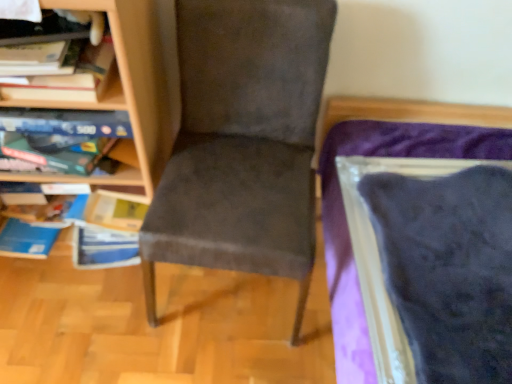
Question: Is wooden bookcase at left outside of suede-like gray chair at center?

Choices:
 (A) no
 (B) yes

Answer: (B)

Question: Is suede-like gray chair at center at the back of wooden bookcase at left?

Choices:
 (A) yes
 (B) no

Answer: (B)

Question: Considering the relative sizes of wooden bookcase at left and suede-like gray chair at center in the image provided, is wooden bookcase at left shorter than suede-like gray chair at center?

Choices:
 (A) yes
 (B) no

Answer: (B)

Question: Does wooden bookcase at left have a smaller size compared to suede-like gray chair at center?

Choices:
 (A) yes
 (B) no

Answer: (B)

Question: Does wooden bookcase at left lie behind suede-like gray chair at center?

Choices:
 (A) yes
 (B) no

Answer: (A)

Question: Does wooden bookcase at left appear on the left side of suede-like gray chair at center?

Choices:
 (A) yes
 (B) no

Answer: (A)

Question: Does suede-like gray chair at center turn towards wooden bookcase at left?

Choices:
 (A) yes
 (B) no

Answer: (B)

Question: Is suede-like gray chair at center directly adjacent to wooden bookcase at left?

Choices:
 (A) no
 (B) yes

Answer: (A)

Question: Considering the relative positions of suede-like gray chair at center and wooden bookcase at left in the image provided, is suede-like gray chair at center in front of wooden bookcase at left?

Choices:
 (A) yes
 (B) no

Answer: (A)

Question: Is suede-like gray chair at center smaller than wooden bookcase at left?

Choices:
 (A) yes
 (B) no

Answer: (A)

Question: From a real-world perspective, is suede-like gray chair at center below wooden bookcase at left?

Choices:
 (A) yes
 (B) no

Answer: (A)

Question: Does suede-like gray chair at center have a greater width compared to wooden bookcase at left?

Choices:
 (A) yes
 (B) no

Answer: (A)

Question: From their relative heights in the image, would you say suede-like gray chair at center is taller or shorter than wooden bookcase at left?

Choices:
 (A) short
 (B) tall

Answer: (A)